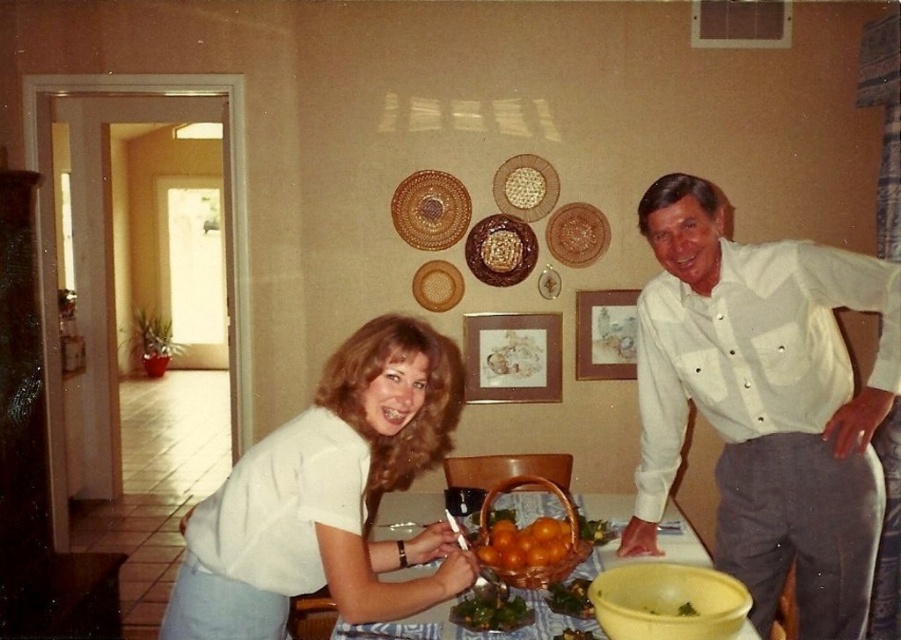
You are standing in the dining area and want to place a small decoration between the two points labeled point (716, 563) and point (478, 248). Which point should the decoration be closer to in order to appear centered from your viewpoint?

The decoration should be placed closer to point (478, 248) because point (716, 563) is closer to the camera, so to appear centered from your viewpoint, the decoration needs to balance the distance in the visual field.

You are standing in the dining area and see the white cotton shirt at center and the brown woven basket at center. Which object is positioned to the right?

The white cotton shirt at center is to the right of the brown woven basket at center.

You are arranging items on a table for a dinner party. You have a woven brown basket at upper center and a rustic woven basket at upper center. According to the image, which basket is positioned lower on the table?

The woven brown basket at upper center is located below the rustic woven basket at upper center, so it is positioned lower on the table.